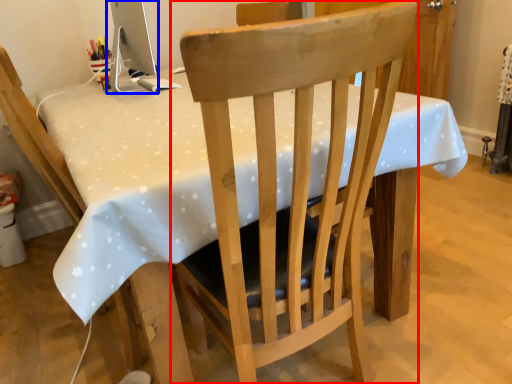
Question: Which point is further to the camera, chair (highlighted by a red box) or computer monitor (highlighted by a blue box)?

Choices:
 (A) chair
 (B) computer monitor

Answer: (B)